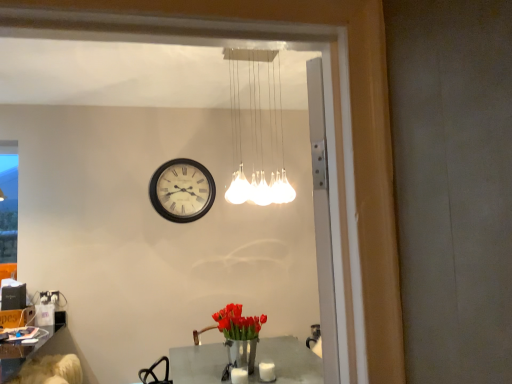
Question: Considering the relative sizes of matte black clock at center and white glass pendant lights at upper center in the image provided, is matte black clock at center wider than white glass pendant lights at upper center?

Choices:
 (A) no
 (B) yes

Answer: (A)

Question: Is matte black clock at center positioned with its back to white glass pendant lights at upper center?

Choices:
 (A) yes
 (B) no

Answer: (B)

Question: Considering the relative positions of matte black clock at center and white glass pendant lights at upper center in the image provided, is matte black clock at center in front of white glass pendant lights at upper center?

Choices:
 (A) yes
 (B) no

Answer: (B)

Question: Is matte black clock at center to the left of white glass pendant lights at upper center from the viewer's perspective?

Choices:
 (A) yes
 (B) no

Answer: (A)

Question: Is there a large distance between matte black clock at center and white glass pendant lights at upper center?

Choices:
 (A) yes
 (B) no

Answer: (B)

Question: In terms of size, does white glass pendant lights at upper center appear bigger or smaller than light brown leather swivel chair at lower left?

Choices:
 (A) small
 (B) big

Answer: (B)

Question: From their relative heights in the image, would you say white glass pendant lights at upper center is taller or shorter than light brown leather swivel chair at lower left?

Choices:
 (A) short
 (B) tall

Answer: (B)

Question: Considering their positions, is white glass pendant lights at upper center located in front of or behind light brown leather swivel chair at lower left?

Choices:
 (A) behind
 (B) front

Answer: (B)

Question: Would you say white glass pendant lights at upper center is to the left or to the right of light brown leather swivel chair at lower left in the picture?

Choices:
 (A) right
 (B) left

Answer: (A)

Question: Based on their sizes in the image, would you say white matte candle at lower center, placed as the second candle when sorted from left to right, is bigger or smaller than light brown leather swivel chair at lower left?

Choices:
 (A) big
 (B) small

Answer: (B)

Question: Is white matte candle at lower center, the first candle from the right, taller or shorter than light brown leather swivel chair at lower left?

Choices:
 (A) short
 (B) tall

Answer: (A)

Question: Is white matte candle at lower center, placed as the second candle when sorted from left to right, to the left or to the right of light brown leather swivel chair at lower left in the image?

Choices:
 (A) left
 (B) right

Answer: (B)

Question: From the image's perspective, is white matte candle at lower center, placed as the second candle when sorted from left to right, above or below light brown leather swivel chair at lower left?

Choices:
 (A) below
 (B) above

Answer: (B)

Question: In terms of height, does matte black clock at center look taller or shorter compared to metallic silver table at center?

Choices:
 (A) tall
 (B) short

Answer: (A)

Question: In the image, is matte black clock at center on the left side or the right side of metallic silver table at center?

Choices:
 (A) right
 (B) left

Answer: (B)